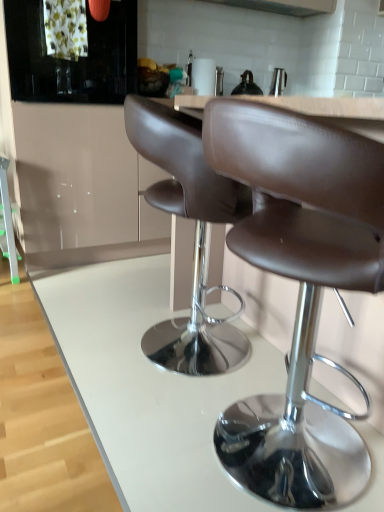
The image size is (384, 512). In order to click on blank area to the left of brown leather stool at center in this screenshot , I will do `click(102, 433)`.